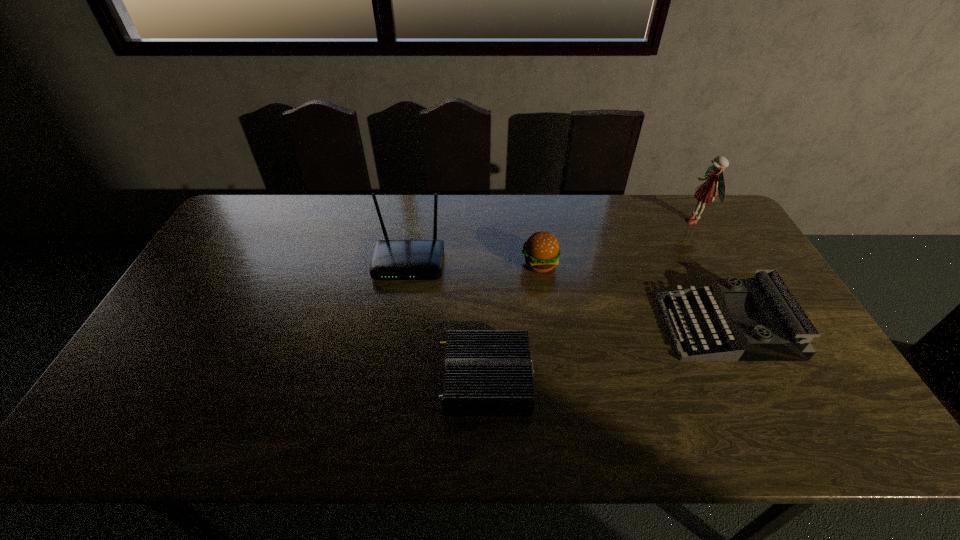
Where is `object situated at the near edge`? object situated at the near edge is located at coordinates (487, 372).

This screenshot has height=540, width=960. What are the coordinates of `doll present at the right edge` in the screenshot? It's located at (705, 193).

The width and height of the screenshot is (960, 540). In order to click on typewriter at the right edge in this screenshot , I will do `click(788, 339)`.

This screenshot has width=960, height=540. What are the coordinates of `object present at the far right corner` in the screenshot? It's located at (705, 193).

Where is `vacant space at the far edge of the desktop`? This screenshot has height=540, width=960. vacant space at the far edge of the desktop is located at coordinates (611, 219).

The height and width of the screenshot is (540, 960). Find the location of `free space at the near edge of the desktop`. free space at the near edge of the desktop is located at coordinates (594, 415).

The width and height of the screenshot is (960, 540). In the image, there is a desktop. Identify the location of vacant region at the left edge. (121, 400).

Locate an element on the screen. free location at the right edge is located at coordinates (764, 326).

Where is `free space at the far left corner of the desktop`? free space at the far left corner of the desktop is located at coordinates click(x=274, y=214).

In the image, there is a desktop. Where is `blank space at the near right corner`? blank space at the near right corner is located at coordinates (819, 441).